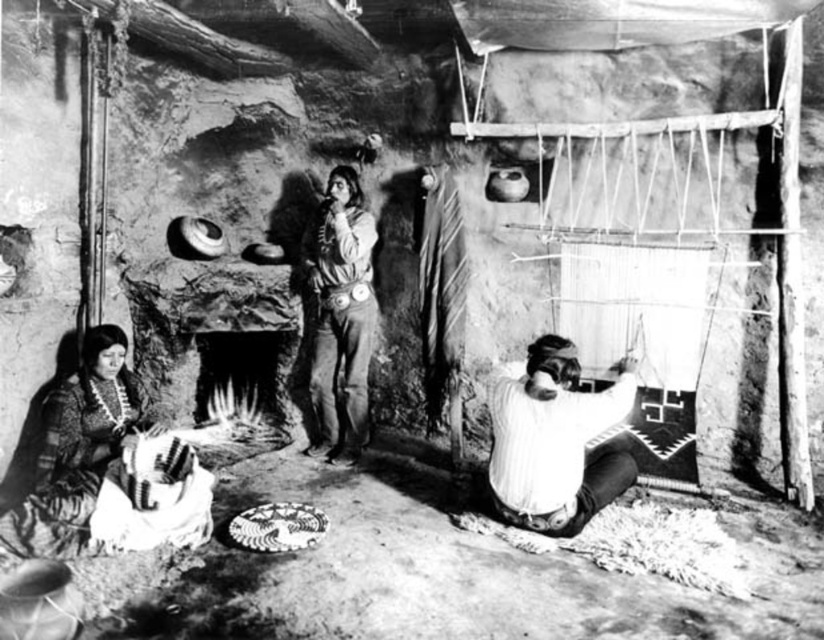
Question: Can you confirm if smooth stone fireplace at center left is positioned to the left of smooth leather jacket at center?

Choices:
 (A) yes
 (B) no

Answer: (A)

Question: Which point appears farthest from the camera in this image?

Choices:
 (A) (363, 244)
 (B) (199, 353)
 (C) (584, 428)

Answer: (B)

Question: Does smooth stone fireplace at center left have a larger size compared to white striped shirt at lower right?

Choices:
 (A) yes
 (B) no

Answer: (A)

Question: Is smooth stone fireplace at center left behind white striped shirt at lower right?

Choices:
 (A) no
 (B) yes

Answer: (B)

Question: Which point is farther to the camera?

Choices:
 (A) (288, 339)
 (B) (593, 508)

Answer: (A)

Question: Which object appears farthest from the camera in this image?

Choices:
 (A) smooth leather jacket at center
 (B) white striped shirt at lower right

Answer: (A)